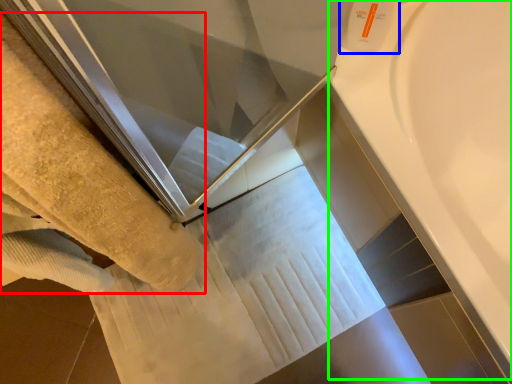
Question: Based on their relative distances, which object is farther from towel (highlighted by a red box)? Choose from toiletry (highlighted by a blue box) and bath (highlighted by a green box).

Choices:
 (A) toiletry
 (B) bath

Answer: (B)